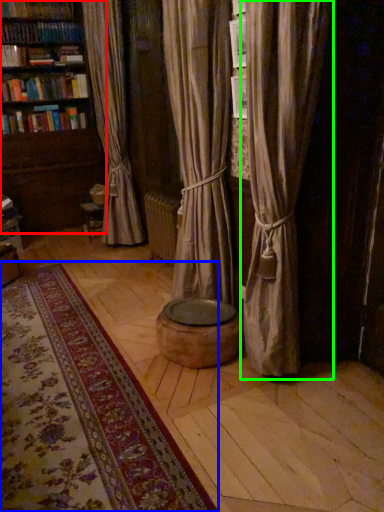
Question: Considering the real-world distances, which object is closest to bookcase (highlighted by a red box)? mat (highlighted by a blue box) or curtain (highlighted by a green box).

Choices:
 (A) mat
 (B) curtain

Answer: (A)